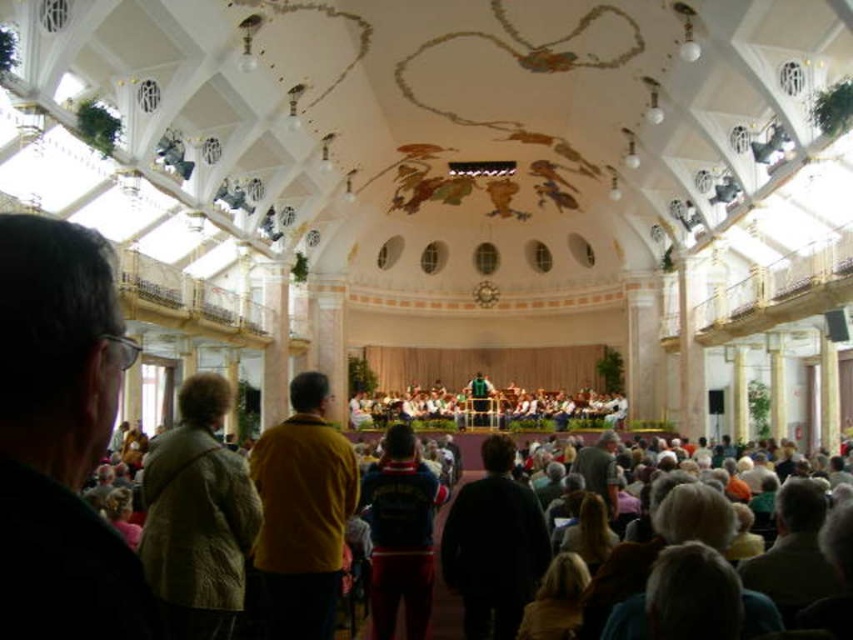
You are standing in the concert hall and see two points marked on the ceiling. The first point is at coordinates point (192, 600) and the second is at point (283, 636). Which point is closer to you?

Point (192, 600) is closer to the viewer than point (283, 636).

You are an event organizer checking the stage setup. You notice two items on the stage at the front of the concert hall. Which one is closer to the audience, the light brown textured jacket at center or the mustard yellow sweater at center?

The light brown textured jacket at center is closer to the audience because it is positioned in front of the mustard yellow sweater at center.